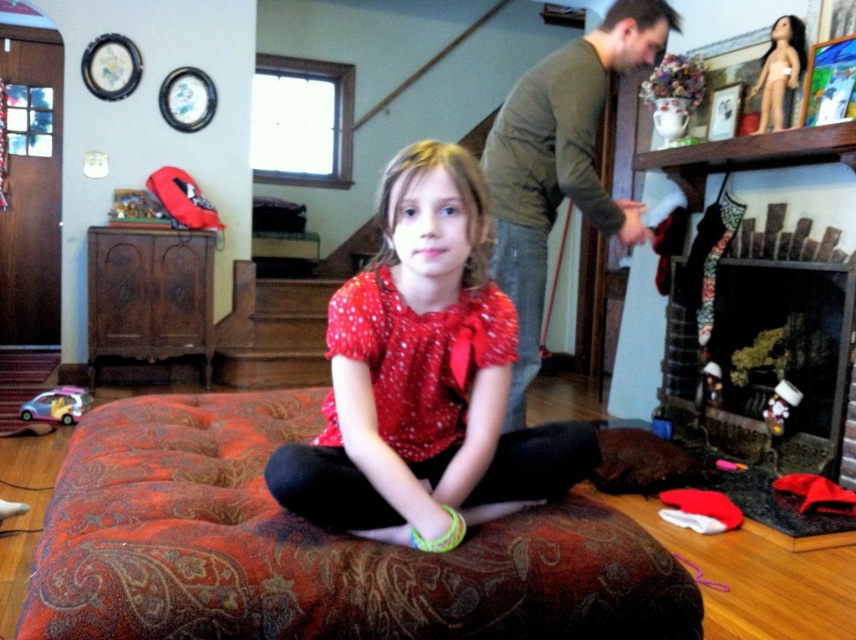
You are a delivery person holding a package that requires a clear path of 4 feet to maneuver. You need to deliver it from the black glass fireplace at lower right to the green cotton shirt at upper right. Can you navigate this path without obstacles?

The distance between the black glass fireplace at lower right and the green cotton shirt at upper right is 4.41 feet, which is greater than the required 4 feet clearance. Therefore, the delivery person can navigate the path without obstacles.

You are a furniture designer who wants to place a new sofa that is 2 meters wide in the living room. The sofa will be positioned near the black glass fireplace at lower right. Based on the scene, will the sofa fit in terms of width if the space allocated for it is determined by the width of the green cotton shirt at upper right?

The black glass fireplace at lower right has a width less than the green cotton shirt at upper right. Since the sofa is 2 meters wide and the space determined by the green cotton shirt at upper right is wider, the sofa should fit as long as other spatial constraints are met.